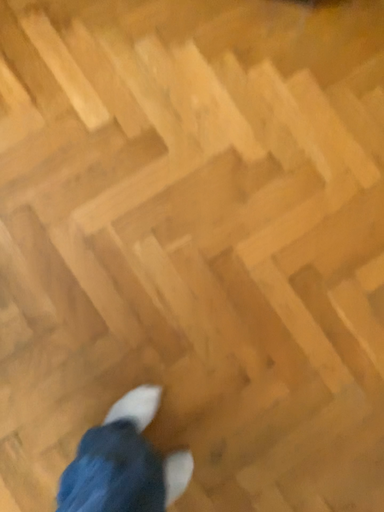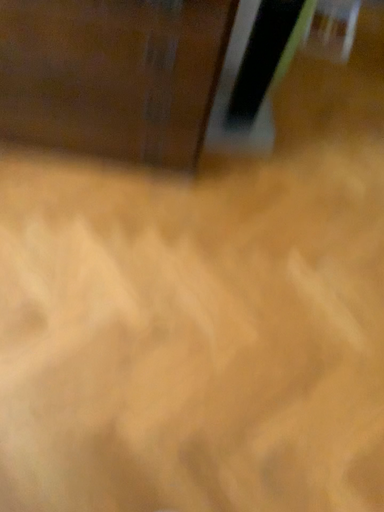
Question: How did the camera likely rotate when shooting the video?

Choices:
 (A) rotated upward
 (B) rotated downward

Answer: (A)